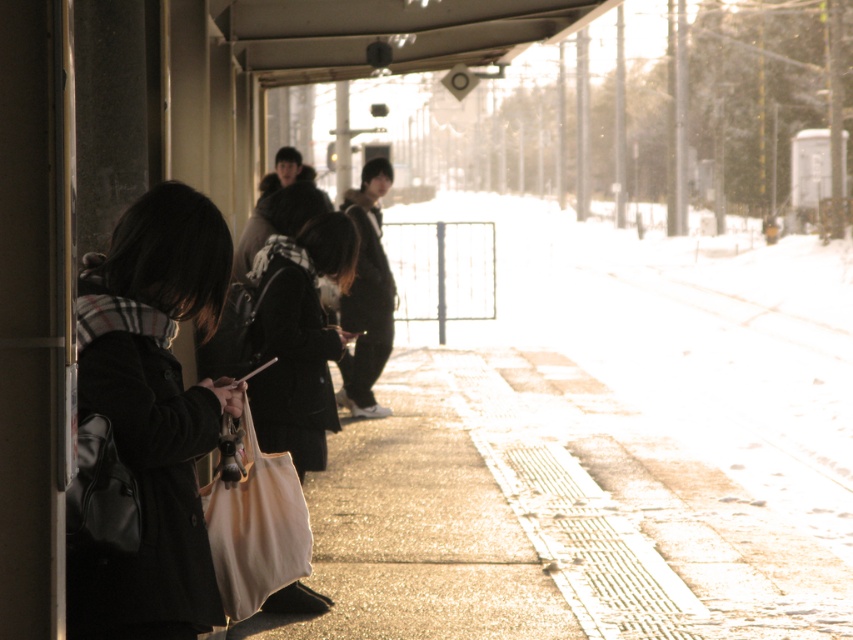
Does black matte coat at center have a greater width compared to beige canvas bag at center?

Correct, the width of black matte coat at center exceeds that of beige canvas bag at center.

What do you see at coordinates (299, 337) in the screenshot?
I see `black matte coat at center` at bounding box center [299, 337].

Who is more forward, (325, 461) or (253, 528)?

Positioned in front is point (253, 528).

The width and height of the screenshot is (853, 640). I want to click on black matte coat at center, so point(299,337).

Does smooth concrete pavement at center appear under beige canvas bag at center?

Correct, smooth concrete pavement at center is located below beige canvas bag at center.

Between smooth concrete pavement at center and beige canvas bag at center, which one has more height?

With more height is smooth concrete pavement at center.

Find the location of `smooth concrete pavement at center`. smooth concrete pavement at center is located at coordinates (548, 518).

Is black wool coat at left wider than black matte coat at center?

No, black wool coat at left is not wider than black matte coat at center.

Does point (148, 552) come behind point (315, 445)?

No.

Who is more distant from viewer, [181,458] or [314,240]?

Point [314,240]

Locate an element on the screen. black wool coat at left is located at coordinates (154, 412).